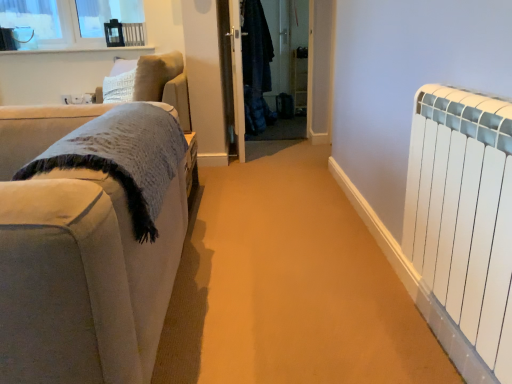
You are a GUI agent. You are given a task and a screenshot of the screen. Output one action in this format:
    pyautogui.click(x=<x>, y=<y>)
    Task: Click on the white glass window at upper left
    
    Given the screenshot: What is the action you would take?
    pyautogui.click(x=72, y=24)

The height and width of the screenshot is (384, 512). What do you see at coordinates (462, 225) in the screenshot?
I see `white matte radiator at right` at bounding box center [462, 225].

You are a GUI agent. You are given a task and a screenshot of the screen. Output one action in this format:
    pyautogui.click(x=<x>, y=<y>)
    Task: Click on the transparent glass door at center, the 2th screen door from the right
    This screenshot has height=384, width=512.
    Given the screenshot: What is the action you would take?
    pyautogui.click(x=237, y=76)

This screenshot has height=384, width=512. What do you see at coordinates (78, 263) in the screenshot?
I see `suede-like beige couch at left` at bounding box center [78, 263].

Identify the location of white glass window at upper left. The width and height of the screenshot is (512, 384). (72, 24).

Is white glass window at upper left spatially inside transparent glass door at center, the first screen door positioned from the left, or outside of it?

white glass window at upper left exists outside the volume of transparent glass door at center, the first screen door positioned from the left.

Is point (99, 16) farther from viewer compared to point (244, 110)?

Yes.

This screenshot has width=512, height=384. I want to click on screen door that is the 2nd object directly below the white glass window at upper left (from a real-world perspective), so click(x=237, y=76).

Is denim jacket at center, which ranks as the first screen door in right-to-left order, situated inside white matte radiator at right or outside?

denim jacket at center, which ranks as the first screen door in right-to-left order, is not enclosed by white matte radiator at right.

Considering the positions of objects denim jacket at center, which ranks as the first screen door in right-to-left order, and white matte radiator at right in the image provided, who is more to the left, denim jacket at center, which ranks as the first screen door in right-to-left order, or white matte radiator at right?

denim jacket at center, which ranks as the first screen door in right-to-left order.

Is denim jacket at center, which ranks as the first screen door in right-to-left order, looking in the opposite direction of white matte radiator at right?

denim jacket at center, which ranks as the first screen door in right-to-left order, does not have its back to white matte radiator at right.

Does white matte radiator at right contain transparent glass door at center, the 2th screen door from the right?

No, transparent glass door at center, the 2th screen door from the right, is located outside of white matte radiator at right.

Does point (467, 343) appear closer or farther from the camera than point (233, 22)?

Clearly, point (467, 343) is closer to the camera than point (233, 22).

Based on the photo, how far apart are white matte radiator at right and transparent glass door at center, the first screen door positioned from the left?

The distance of white matte radiator at right from transparent glass door at center, the first screen door positioned from the left, is 7.56 feet.

Between white matte radiator at right and transparent glass door at center, the first screen door positioned from the left, which one has smaller width?

transparent glass door at center, the first screen door positioned from the left.

Which is behind, white matte radiator at right or white glass window at upper left?

white glass window at upper left is more distant.

Which is closer to the camera, (x=413, y=219) or (x=100, y=9)?

The point (x=413, y=219) is in front.

Could you tell me if white matte radiator at right is turned towards white glass window at upper left?

No, white matte radiator at right is not oriented towards white glass window at upper left.

From the picture: How far apart are white matte radiator at right and white glass window at upper left?

white matte radiator at right is 3.37 meters away from white glass window at upper left.

Is transparent glass door at center, the first screen door positioned from the left, in front of or behind white glass window at upper left in the image?

transparent glass door at center, the first screen door positioned from the left, is positioned closer to the viewer than white glass window at upper left.

Is transparent glass door at center, the first screen door positioned from the left, not within white glass window at upper left?

transparent glass door at center, the first screen door positioned from the left, lies outside white glass window at upper left's area.

From the image's perspective, is transparent glass door at center, the 2th screen door from the right, positioned above or below white glass window at upper left?

transparent glass door at center, the 2th screen door from the right, is situated lower than white glass window at upper left in the image.

You are a GUI agent. You are given a task and a screenshot of the screen. Output one action in this format:
    pyautogui.click(x=<x>, y=<y>)
    Task: Click on the screen door that is the 1st one when counting rightward from the white glass window at upper left
    The height and width of the screenshot is (384, 512).
    Given the screenshot: What is the action you would take?
    pyautogui.click(x=237, y=76)

Is white glass window at upper left oriented towards suede-like beige couch at left?

No, white glass window at upper left is not turned towards suede-like beige couch at left.

Which object is positioned more to the right, white glass window at upper left or suede-like beige couch at left?

Positioned to the right is suede-like beige couch at left.

The height and width of the screenshot is (384, 512). What are the coordinates of `window above the suede-like beige couch at left (from a real-world perspective)` in the screenshot? It's located at 72,24.

Is white glass window at upper left not close to suede-like beige couch at left?

white glass window at upper left is positioned a significant distance from suede-like beige couch at left.

Does point (137, 47) lie behind point (470, 353)?

That is True.

Which object is thinner, white glossy window sill at upper left or white matte radiator at right?

white matte radiator at right is thinner.

In terms of height, does white glossy window sill at upper left look taller or shorter compared to white matte radiator at right?

white glossy window sill at upper left is shorter than white matte radiator at right.

Consider the image. From a real-world perspective, relative to white matte radiator at right, is white glossy window sill at upper left vertically above or below?

In terms of real-world spatial position, white glossy window sill at upper left is above white matte radiator at right.

The image size is (512, 384). What are the coordinates of `screen door located in front of the white glass window at upper left` in the screenshot? It's located at (237, 76).

Locate an element on the screen. The width and height of the screenshot is (512, 384). screen door that is the 2nd one when counting upward from the white matte radiator at right (from the image's perspective) is located at coordinates (272, 61).

Estimate the real-world distances between objects in this image. Which object is further from white glass window at upper left, transparent glass door at center, the 2th screen door from the right, or denim jacket at center, which ranks as the first screen door in right-to-left order?

denim jacket at center, which ranks as the first screen door in right-to-left order.

Estimate the real-world distances between objects in this image. Which object is closer to white glass window at upper left, white glossy window sill at upper left or transparent glass door at center, the 2th screen door from the right?

Among the two, white glossy window sill at upper left is located nearer to white glass window at upper left.

Looking at the image, which one is located closer to transparent glass door at center, the first screen door positioned from the left, white glass window at upper left or white glossy window sill at upper left?

white glossy window sill at upper left lies closer to transparent glass door at center, the first screen door positioned from the left, than the other object.

Based on the photo, estimate the real-world distances between objects in this image. Which object is further from denim jacket at center, which ranks as the first screen door in right-to-left order, white glass window at upper left or transparent glass door at center, the 2th screen door from the right?

The object further to denim jacket at center, which ranks as the first screen door in right-to-left order, is white glass window at upper left.

Looking at the image, which one is located closer to white glossy window sill at upper left, transparent glass door at center, the first screen door positioned from the left, or white matte radiator at right?

Based on the image, transparent glass door at center, the first screen door positioned from the left, appears to be nearer to white glossy window sill at upper left.

Considering their positions, is suede-like beige couch at left positioned closer to white glass window at upper left than transparent glass door at center, the first screen door positioned from the left?

transparent glass door at center, the first screen door positioned from the left, is positioned closer to the anchor white glass window at upper left.

Which object lies further to the anchor point white matte radiator at right, suede-like beige couch at left or white glossy window sill at upper left?

white glossy window sill at upper left is positioned further to the anchor white matte radiator at right.

From the image, which object appears to be nearer to suede-like beige couch at left, transparent glass door at center, the 2th screen door from the right, or denim jacket at center, which ranks as the first screen door in right-to-left order?

transparent glass door at center, the 2th screen door from the right.

Locate an element on the screen. The width and height of the screenshot is (512, 384). screen door between suede-like beige couch at left and white glass window at upper left from front to back is located at coordinates (237, 76).

The height and width of the screenshot is (384, 512). I want to click on window sill between white glass window at upper left and transparent glass door at center, the 2th screen door from the right, in the horizontal direction, so click(x=78, y=50).

Where is `screen door between suede-like beige couch at left and denim jacket at center, which ranks as the first screen door in right-to-left order, from front to back`? This screenshot has height=384, width=512. screen door between suede-like beige couch at left and denim jacket at center, which ranks as the first screen door in right-to-left order, from front to back is located at coordinates (237, 76).

Locate an element on the screen. radiator located between suede-like beige couch at left and white glossy window sill at upper left in the depth direction is located at coordinates (462, 225).